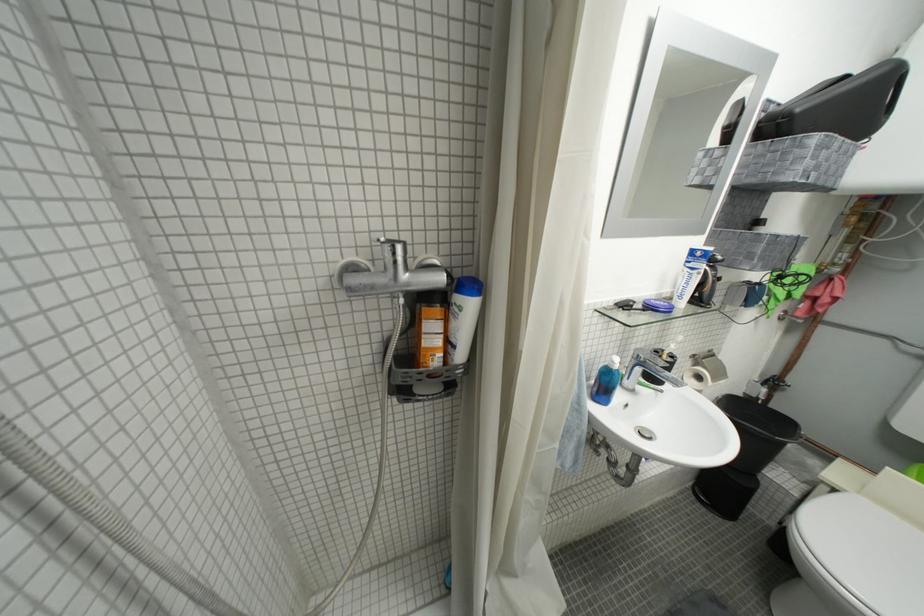
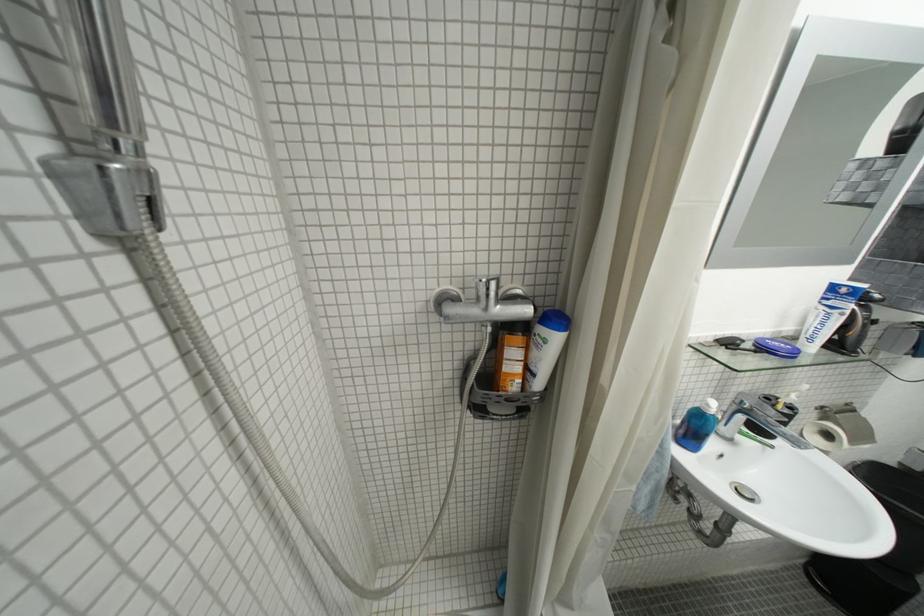
In the second image, find the point that corresponds to (x=614, y=399) in the first image.

(700, 445)